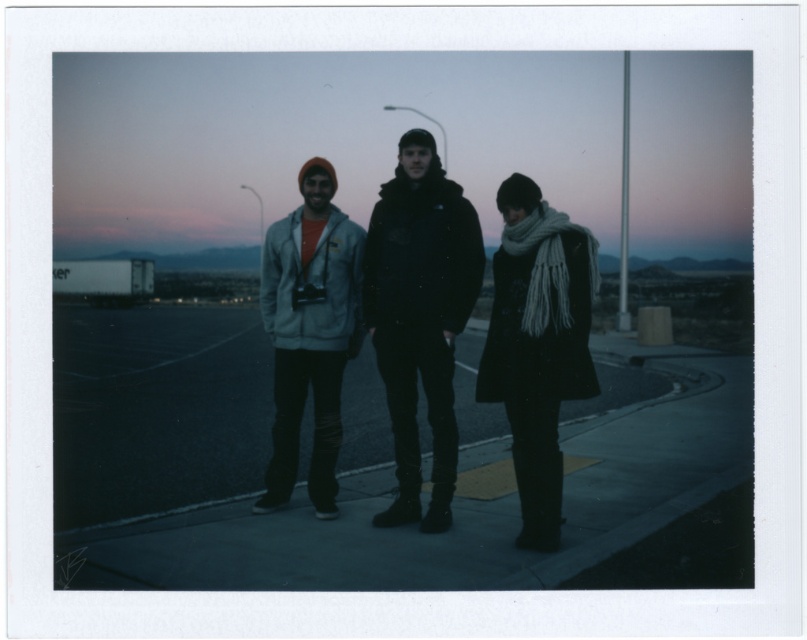
You are a photographer trying to capture a group photo of the knitted scarf at center and the matte gray hoodie at center. The camera you have can only focus on objects within a 1.2 meter width. Given their widths, will both subjects fit within the camera frame?

The knitted scarf at center has a larger width than the matte gray hoodie at center. Since the camera can only focus on objects within a 1.2 meter width, and the knitted scarf at center is wider, it may exceed the frame. However, if both are positioned closely together within the 1.2 meter limit, they might fit. The exact fit depends on their combined width, but based on the given information, the knitted scarf at center alone might already exceed the limit.

You are a delivery person who needs to place a package on the dark asphalt pavement at center. However, there is a black matte jacket at center in the way. Can you move the jacket to the right to make space for the package?

The dark asphalt pavement at center is to the left of the black matte jacket at center, so moving the jacket to the right would free up space on the pavement at center for the package.